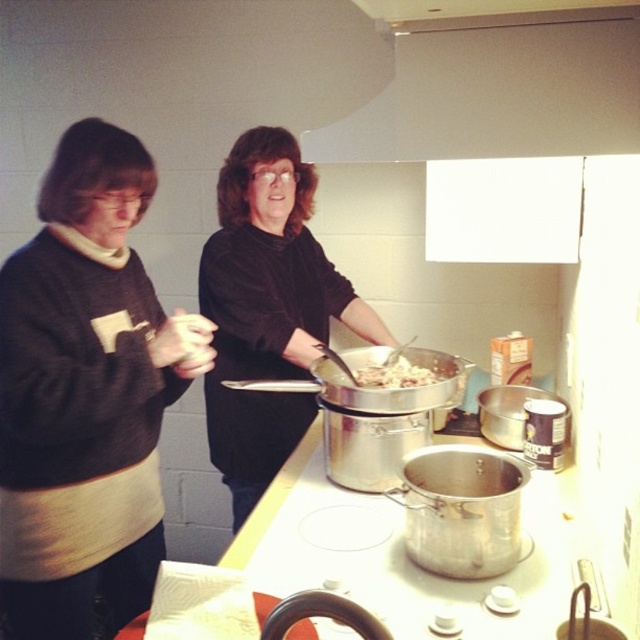
You are a chef in a busy kitchen and need to place a small bowl of white creamy food at center onto the counter. The white matte exhaust hood at upper center is in the way. Can you move the bowl past the exhaust hood to the counter?

The white matte exhaust hood at upper center has a larger size compared to white creamy food at center. Since the exhaust hood is larger and located above the center, it might block the path. However, the bowl is small, so you can likely move it around or under the exhaust hood to place it on the counter.

You are standing in a kitchen and see the matte black sweater at left and the white matte exhaust hood at upper center. Which object is located to the left of the other?

The matte black sweater at left is positioned on the left side of white matte exhaust hood at upper center.

You are a chef standing in the kitchen. You need to hang a 1.2 meter tall poster on the wall behind the matte black sweater at left and the white matte exhaust hood at upper center. Which object should you place the poster next to so it doesn

The matte black sweater at left is much taller than the white matte exhaust hood at upper center, so you should place the poster next to the white matte exhaust hood at upper center to ensure it fits vertically without exceeding the poster